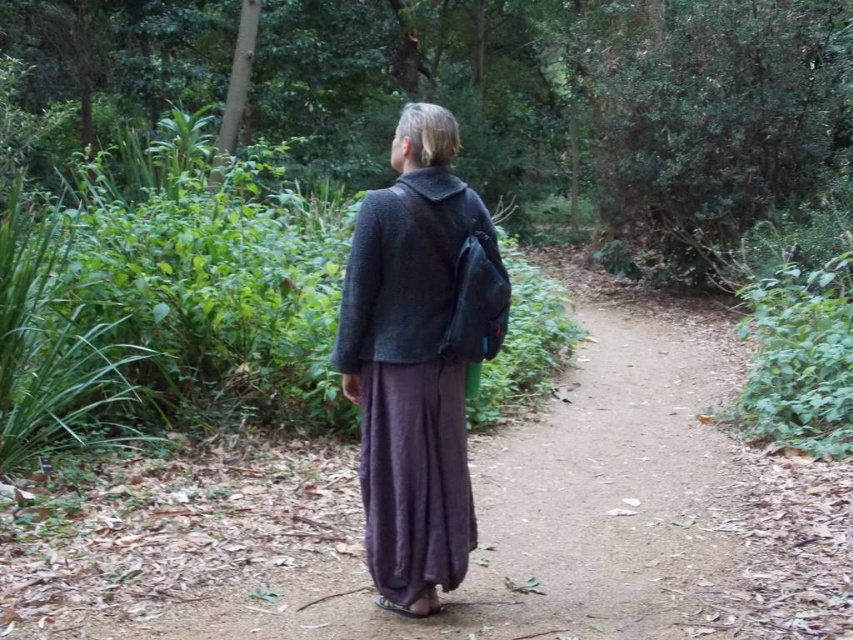
Question: Among these objects, which one is nearest to the camera?

Choices:
 (A) dark gray fabric jacket at center
 (B) dark gray woolen jacket at center

Answer: (B)

Question: Is dark gray fabric jacket at center positioned behind dark gray woolen jacket at center?

Choices:
 (A) no
 (B) yes

Answer: (B)

Question: Does dark gray fabric jacket at center lie in front of dark gray woolen jacket at center?

Choices:
 (A) no
 (B) yes

Answer: (A)

Question: Which point is closer to the camera taking this photo?

Choices:
 (A) (433, 257)
 (B) (404, 129)

Answer: (A)

Question: Is dark gray fabric jacket at center smaller than dark gray woolen jacket at center?

Choices:
 (A) no
 (B) yes

Answer: (A)